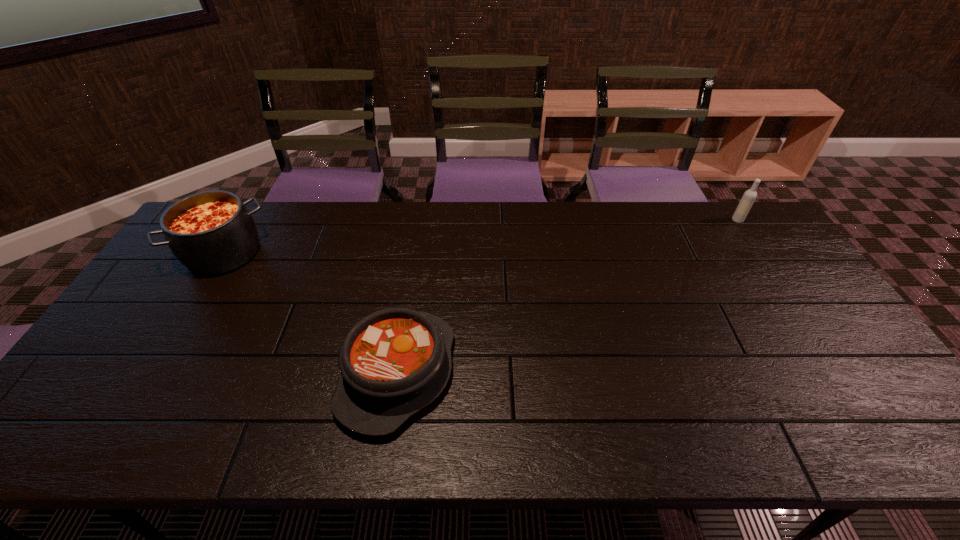
Find the location of a particular element. Image resolution: width=960 pixels, height=540 pixels. the rightmost object is located at coordinates (746, 202).

Identify the location of vodka. This screenshot has width=960, height=540. (746, 202).

You are a GUI agent. You are given a task and a screenshot of the screen. Output one action in this format:
    pyautogui.click(x=<x>, y=<y>)
    Task: Click on the farther casserole
    The height and width of the screenshot is (540, 960).
    Given the screenshot: What is the action you would take?
    pyautogui.click(x=212, y=232)

You are a GUI agent. You are given a task and a screenshot of the screen. Output one action in this format:
    pyautogui.click(x=<x>, y=<y>)
    Task: Click on the second farthest object
    The width and height of the screenshot is (960, 540).
    Given the screenshot: What is the action you would take?
    pyautogui.click(x=212, y=232)

Where is `the right casserole`? The image size is (960, 540). the right casserole is located at coordinates (394, 362).

Locate an element on the screen. This screenshot has height=540, width=960. the nearer casserole is located at coordinates (394, 362).

Identify the location of blank space located 0.070m on the back of the rightmost object. The image size is (960, 540). (728, 205).

Find the location of a particular element. This screenshot has height=540, width=960. blank space located 0.180m on the front of the farther casserole is located at coordinates click(179, 327).

At what (x,y) coordinates should I click in order to perform the action: click on free space located on the left of the shorter casserole. Please return your answer as a coordinate pair (x, y). This screenshot has height=540, width=960. Looking at the image, I should click on (234, 373).

In order to click on vodka that is at the far edge in this screenshot , I will do `click(746, 202)`.